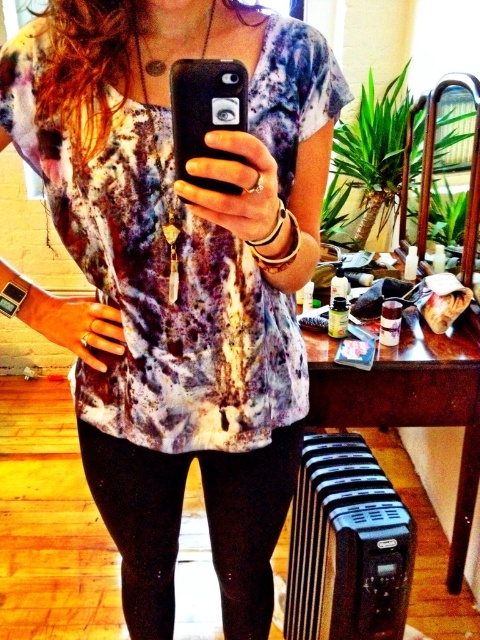
Question: Which point appears closest to the camera in this image?

Choices:
 (A) (192, 262)
 (B) (189, 96)

Answer: (B)

Question: Which is nearer to the black spandex leggings at lower center?

Choices:
 (A) matte tie-dye blouse at center
 (B) black matte phone at center

Answer: (A)

Question: In this image, where is black spandex leggings at lower center located relative to black matte phone at center?

Choices:
 (A) below
 (B) above

Answer: (A)

Question: Is matte tie-dye blouse at center positioned in front of black matte phone at center?

Choices:
 (A) no
 (B) yes

Answer: (A)

Question: Is matte tie-dye blouse at center thinner than black spandex leggings at lower center?

Choices:
 (A) no
 (B) yes

Answer: (A)

Question: Which point is farther to the camera?

Choices:
 (A) black matte phone at center
 (B) black spandex leggings at lower center
 (C) matte tie-dye blouse at center

Answer: (B)